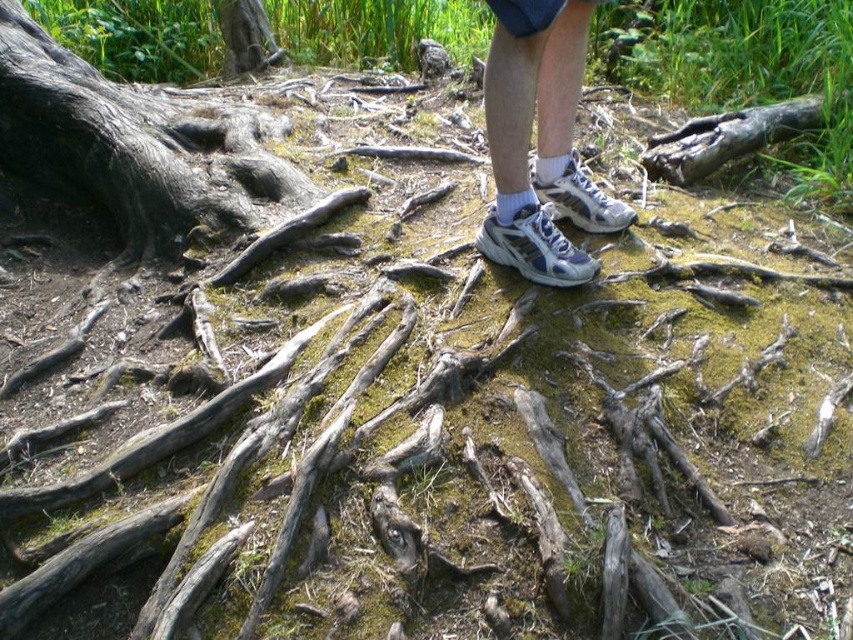
You are hiking and need to step over an obstacle. You see the dark gray rough bark at left and the white mesh sneakers at center. Which object is bigger and requires more space to step over?

The dark gray rough bark at left is larger in size compared to the white mesh sneakers at center, so it requires more space to step over.

Consider the image. You are standing in a forest area with tree roots and moss. There is a point labeled as point (132, 145). What is located at that point?

The point (132, 145) corresponds to dark gray rough bark at left.